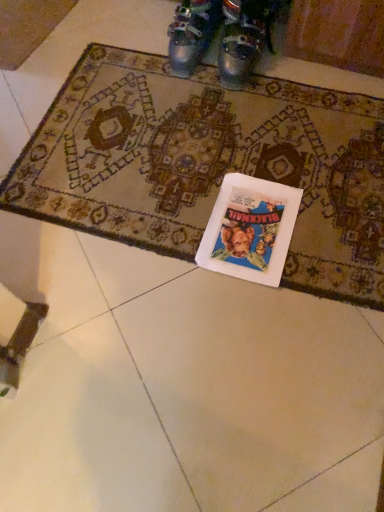
Where is `free spot to the left of metallic silver shoes at upper center, arranged as the 1th footwear when viewed from the right`? Image resolution: width=384 pixels, height=512 pixels. free spot to the left of metallic silver shoes at upper center, arranged as the 1th footwear when viewed from the right is located at coordinates (182, 71).